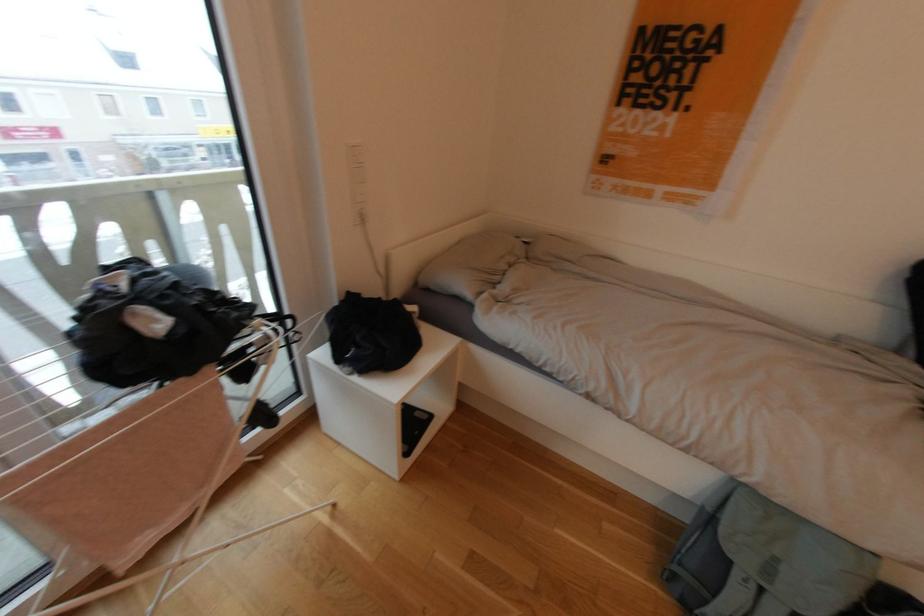
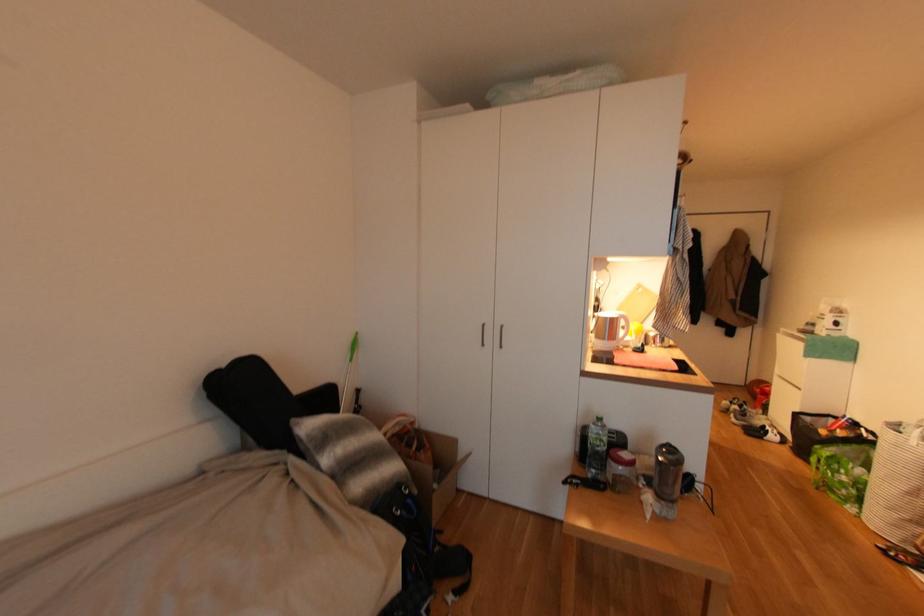
Question: The first image is from the beginning of the video and the second image is from the end. How did the camera likely rotate when shooting the video?

Choices:
 (A) Left
 (B) Right
 (C) Up
 (D) Down

Answer: (B)